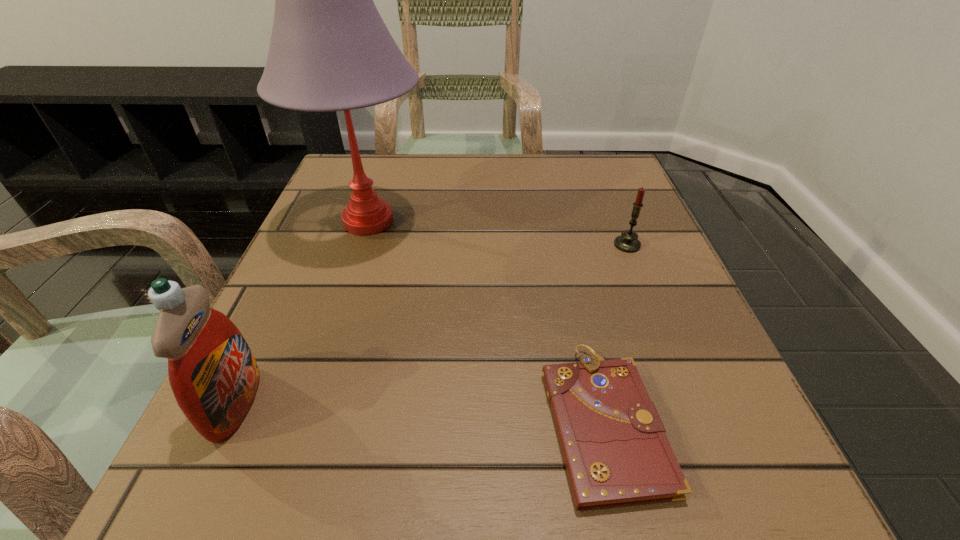
Locate an element on the screen. The image size is (960, 540). object that is positioned at the far edge is located at coordinates (330, 50).

Find the location of `detergent that is at the near edge`. detergent that is at the near edge is located at coordinates (213, 374).

This screenshot has height=540, width=960. I want to click on notebook at the near edge, so click(616, 453).

Where is `table lamp that is at the left edge`? table lamp that is at the left edge is located at coordinates (330, 50).

Identify the location of detergent present at the left edge. (213, 374).

You are a GUI agent. You are given a task and a screenshot of the screen. Output one action in this format:
    pyautogui.click(x=<x>, y=<y>)
    Task: Click on the candle that is at the right edge
    
    Given the screenshot: What is the action you would take?
    pyautogui.click(x=628, y=242)

You are a GUI agent. You are given a task and a screenshot of the screen. Output one action in this format:
    pyautogui.click(x=<x>, y=<y>)
    Task: Click on the notebook that is at the right edge
    This screenshot has width=960, height=540.
    Given the screenshot: What is the action you would take?
    pyautogui.click(x=616, y=453)

In order to click on object present at the far left corner in this screenshot , I will do `click(330, 50)`.

At what (x,y) coordinates should I click in order to perform the action: click on object that is at the near left corner. Please return your answer as a coordinate pair (x, y). Looking at the image, I should click on (213, 374).

Locate an element on the screen. object present at the near right corner is located at coordinates (616, 453).